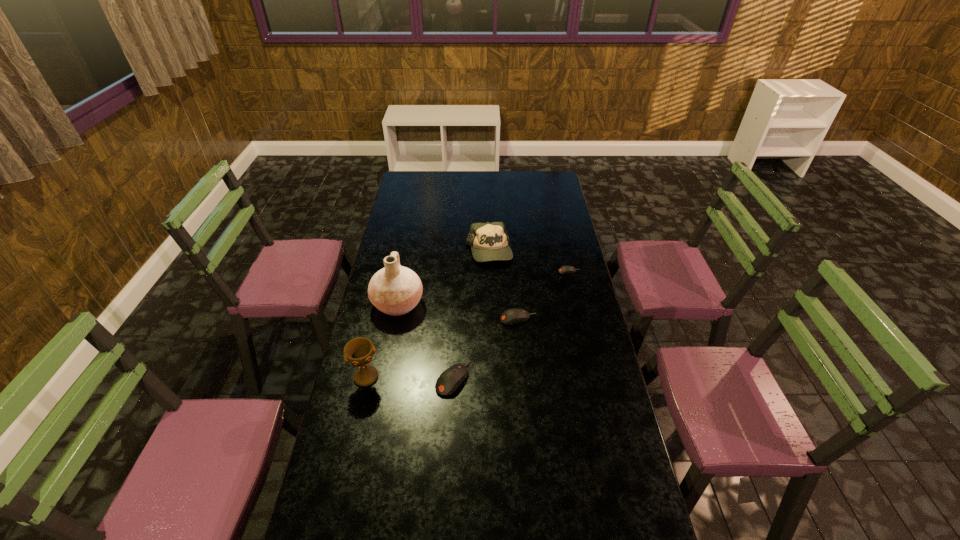
You are a GUI agent. You are given a task and a screenshot of the screen. Output one action in this format:
    pyautogui.click(x=<x>, y=<y>)
    Task: Click on the free space that satisfies the following two spatial constraints: 1. on the back side of the chalice; 2. on the right side of the farthest computer mouse
    This screenshot has height=540, width=960.
    Given the screenshot: What is the action you would take?
    pyautogui.click(x=391, y=272)

At what (x,y) coordinates should I click in order to perform the action: click on free space in the image that satisfies the following two spatial constraints: 1. on the front-facing side of the third tallest object; 2. on the left side of the second computer mouse from left to right. Please return your answer as a coordinate pair (x, y). This screenshot has width=960, height=540. Looking at the image, I should click on (491, 319).